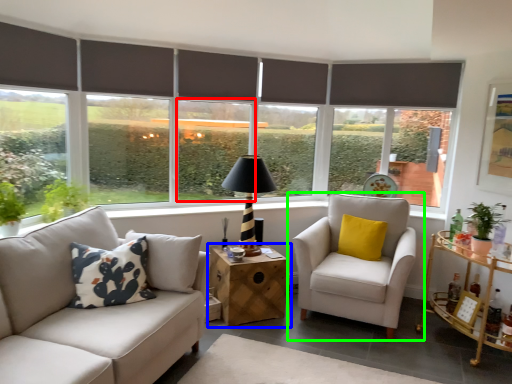
Question: Which object is positioned farthest from window (highlighted by a red box)? Select from table (highlighted by a blue box) and chair (highlighted by a green box).

Choices:
 (A) table
 (B) chair

Answer: (B)